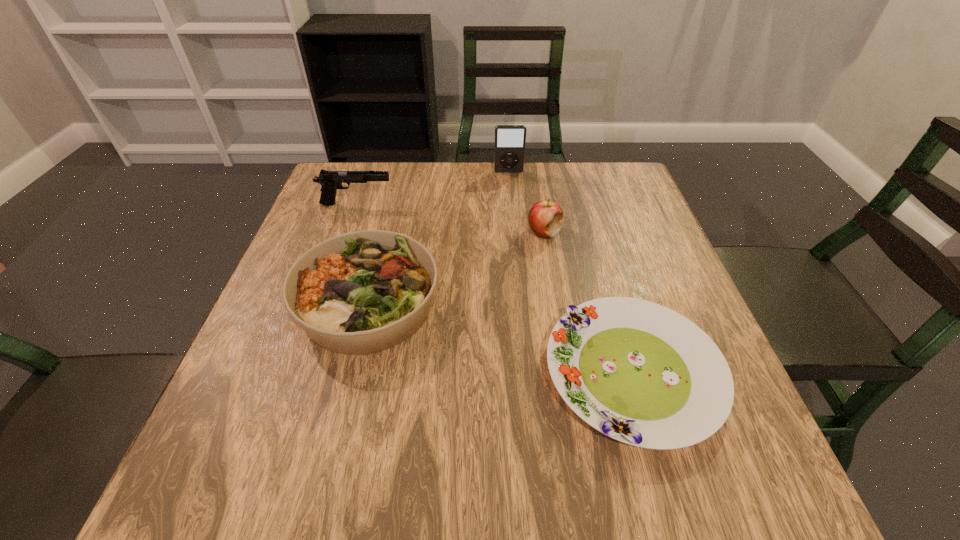
Identify the location of the tallest object. Image resolution: width=960 pixels, height=540 pixels. (509, 152).

Locate an element on the screen. This screenshot has width=960, height=540. iPod is located at coordinates (509, 152).

In order to click on gun in this screenshot , I will do point(330,181).

At what (x,y) coordinates should I click in order to perform the action: click on apple. Please return your answer as a coordinate pair (x, y). The height and width of the screenshot is (540, 960). Looking at the image, I should click on (545, 217).

Locate an element on the screen. The image size is (960, 540). the left salad plate is located at coordinates (362, 292).

Image resolution: width=960 pixels, height=540 pixels. What are the coordinates of `the right salad plate` in the screenshot? It's located at (638, 372).

This screenshot has width=960, height=540. I want to click on the shortest object, so click(638, 372).

Where is `vacant space located 0.400m on the front-facing side of the iPod`? This screenshot has height=540, width=960. vacant space located 0.400m on the front-facing side of the iPod is located at coordinates (517, 266).

At what (x,y) coordinates should I click in order to perform the action: click on vacant space situated at the aiming end of the gun. Please return your answer as a coordinate pair (x, y). Looking at the image, I should click on (412, 204).

Locate an element on the screen. The image size is (960, 540). free space located on the left of the third farthest object is located at coordinates (438, 233).